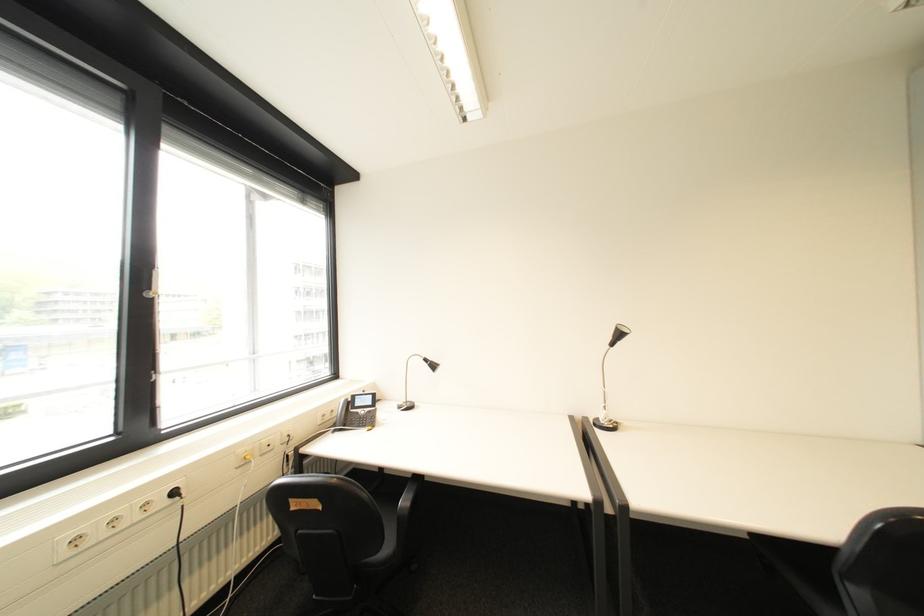
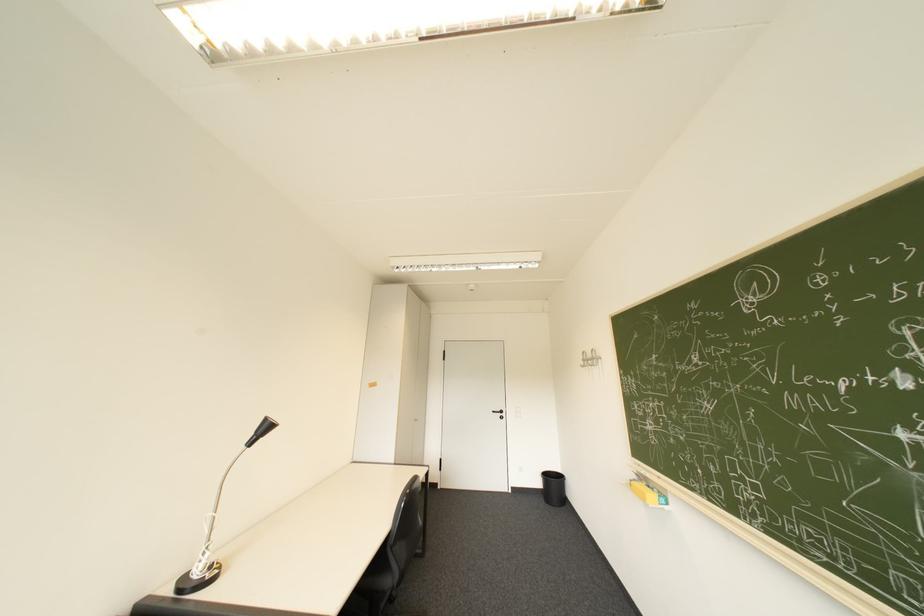
Where in the second image is the point corresponding to the point at 623,338 from the first image?

(266, 434)